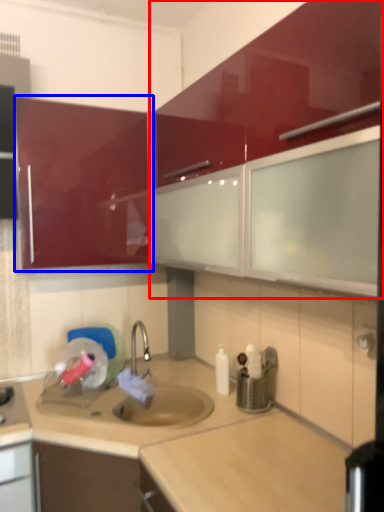
Question: Among these objects, which one is nearest to the camera, cabinetry (highlighted by a red box) or cabinetry (highlighted by a blue box)?

Choices:
 (A) cabinetry
 (B) cabinetry

Answer: (A)